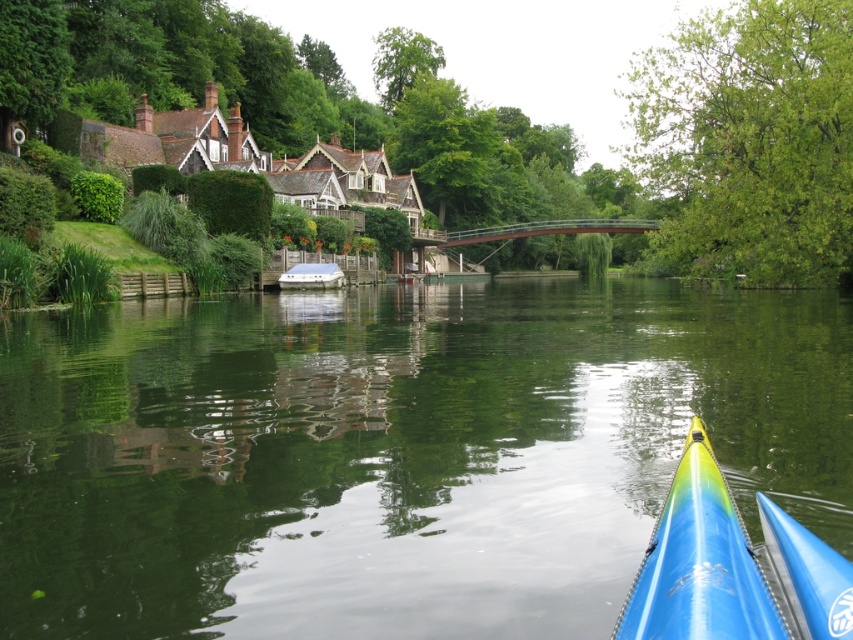
Does green smooth water at center have a smaller size compared to blue glossy canoe at lower right?

Incorrect, green smooth water at center is not smaller in size than blue glossy canoe at lower right.

In the scene shown: Can you confirm if green smooth water at center is wider than blue glossy canoe at lower right?

Yes, green smooth water at center is wider than blue glossy canoe at lower right.

At what (x,y) coordinates should I click in order to perform the action: click on green smooth water at center. Please return your answer as a coordinate pair (x, y). Looking at the image, I should click on (396, 452).

Does green smooth water at center have a smaller size compared to white plastic boat at center?

Actually, green smooth water at center might be larger than white plastic boat at center.

Is point (270, 502) closer to camera compared to point (282, 280)?

That is True.

Locate an element on the screen. green smooth water at center is located at coordinates (396, 452).

Does shiny blue kayak at lower right have a smaller size compared to blue glossy canoe at lower right?

No, shiny blue kayak at lower right is not smaller than blue glossy canoe at lower right.

Measure the distance between point (676, 477) and camera.

Point (676, 477) and camera are 35.13 feet apart.

What do you see at coordinates (699, 563) in the screenshot? I see `shiny blue kayak at lower right` at bounding box center [699, 563].

Where is `shiny blue kayak at lower right`? shiny blue kayak at lower right is located at coordinates [x=699, y=563].